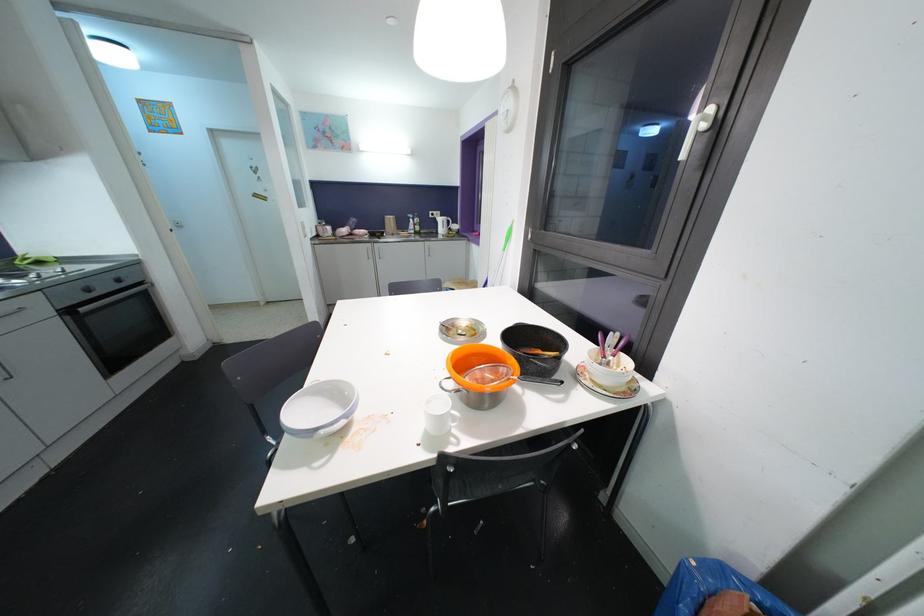
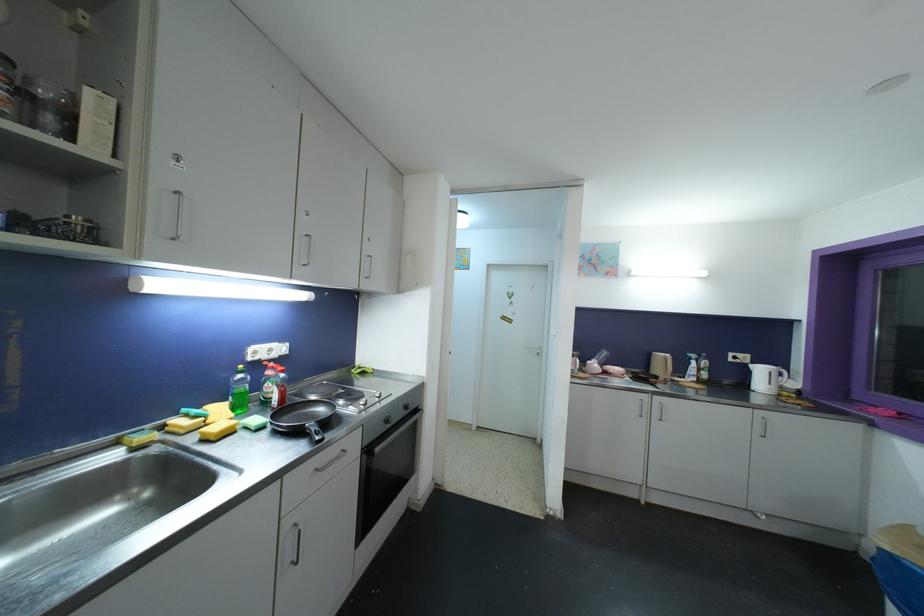
In the second image, find the point that corresponds to [91,293] in the first image.

(390, 424)